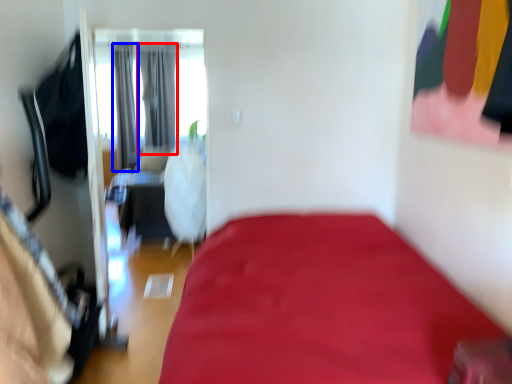
Question: Which object is further to the camera taking this photo, curtain (highlighted by a red box) or curtain (highlighted by a blue box)?

Choices:
 (A) curtain
 (B) curtain

Answer: (A)